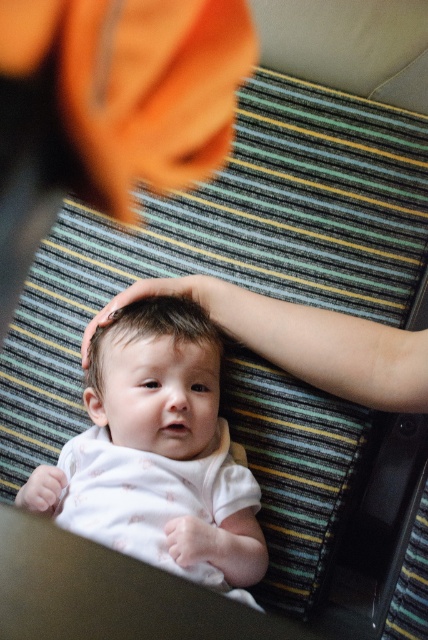
Does white soft baby at center appear under smooth white baby head at center?

Indeed, white soft baby at center is positioned under smooth white baby head at center.

Which of these two, white soft baby at center or smooth white baby head at center, stands taller?

Standing taller between the two is white soft baby at center.

Does point (181, 484) lie behind point (106, 388)?

No.

Locate an element on the screen. The height and width of the screenshot is (640, 428). white soft baby at center is located at coordinates (157, 451).